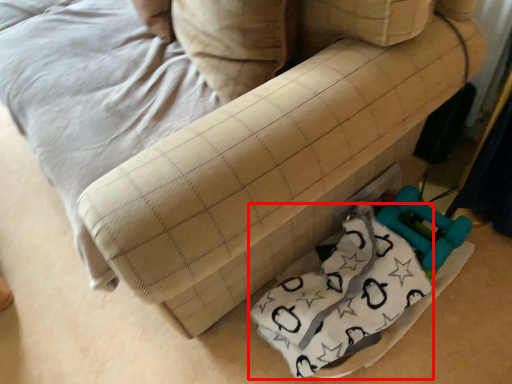
Question: Considering the relative positions of material (annotated by the red box) and pillow in the image provided, where is material (annotated by the red box) located with respect to the staircase?

Choices:
 (A) right
 (B) left

Answer: (A)